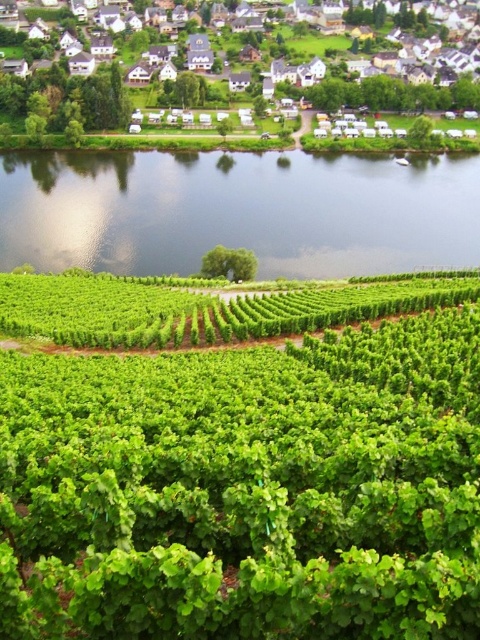
Which is in front, point (37, 192) or point (118, 35)?

Point (37, 192) is in front.

Does green leafy river at center appear over white wooden houses at upper center?

Actually, green leafy river at center is below white wooden houses at upper center.

Is point (48, 209) positioned before point (15, 93)?

Yes, point (48, 209) is closer to viewer.

What are the coordinates of `green leafy river at center` in the screenshot? It's located at (238, 211).

The width and height of the screenshot is (480, 640). What do you see at coordinates (243, 467) in the screenshot?
I see `green leafy vines at center` at bounding box center [243, 467].

Where is `green leafy vines at center`? The width and height of the screenshot is (480, 640). green leafy vines at center is located at coordinates (243, 467).

Does green leafy vines at center appear on the right side of green leafy river at center?

Yes, green leafy vines at center is to the right of green leafy river at center.

The height and width of the screenshot is (640, 480). In order to click on green leafy vines at center in this screenshot , I will do `click(243, 467)`.